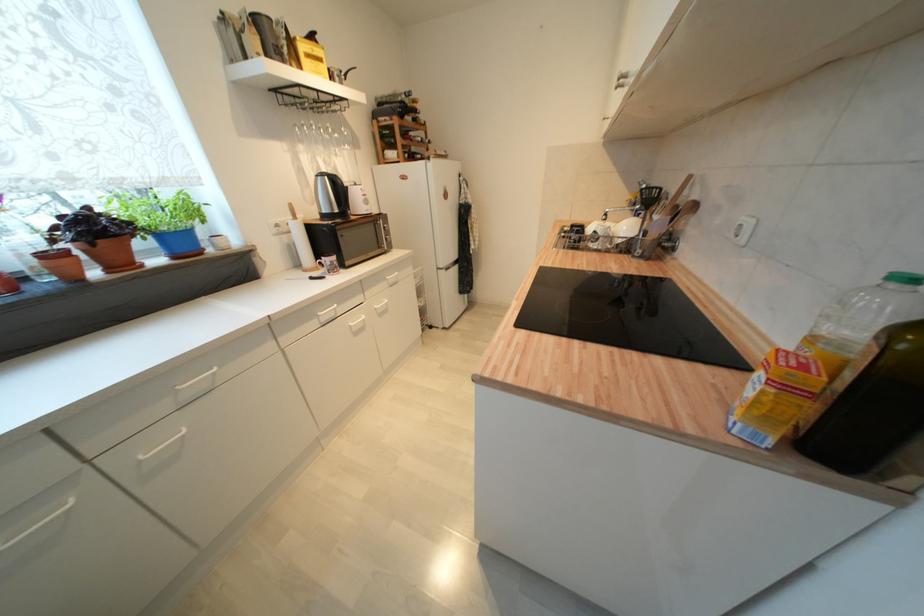
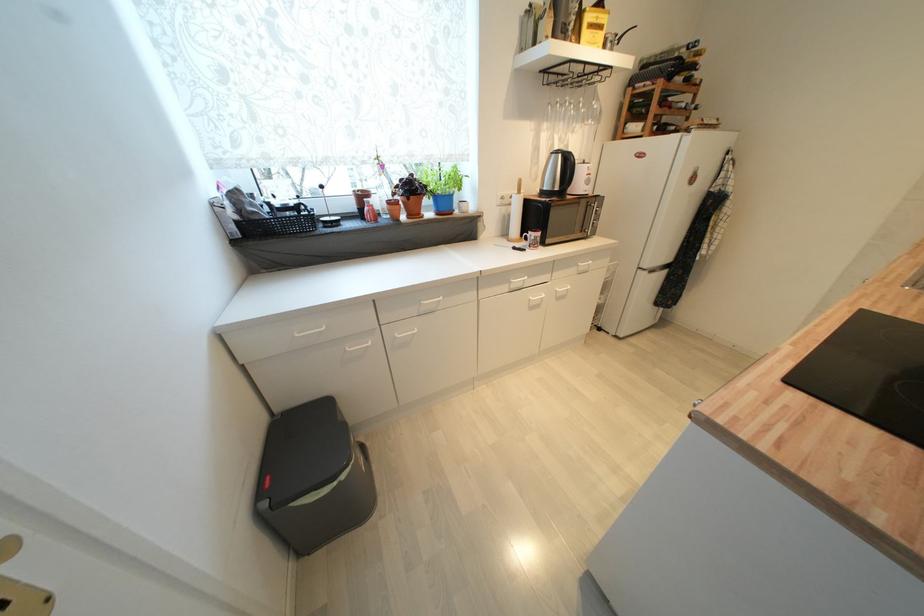
The point at (325, 148) is marked in the first image. Where is the corresponding point in the second image?

(566, 127)